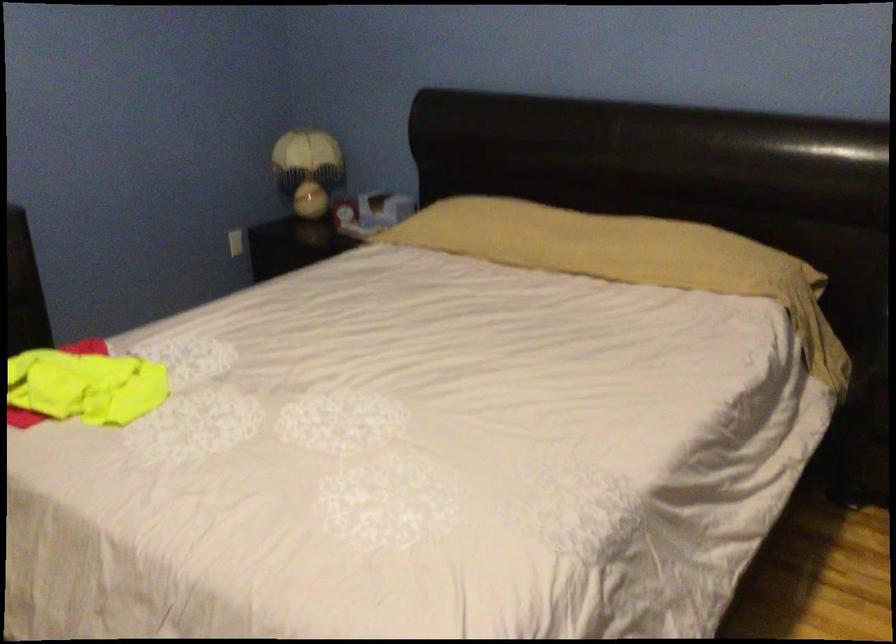
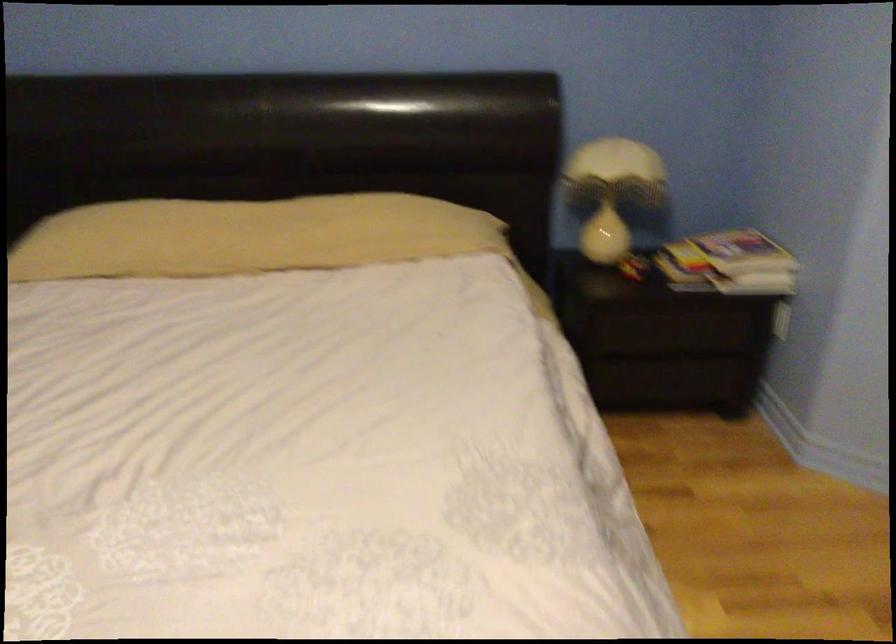
Locate, in the second image, the point that corresponds to [561,234] in the first image.

(247, 236)